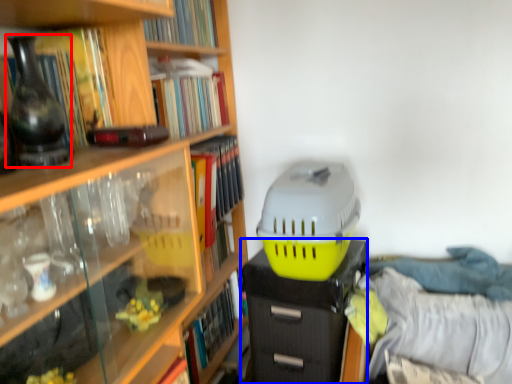
Question: Which of the following is the farthest to the observer, vase (highlighted by a red box) or file cabinet (highlighted by a blue box)?

Choices:
 (A) vase
 (B) file cabinet

Answer: (B)